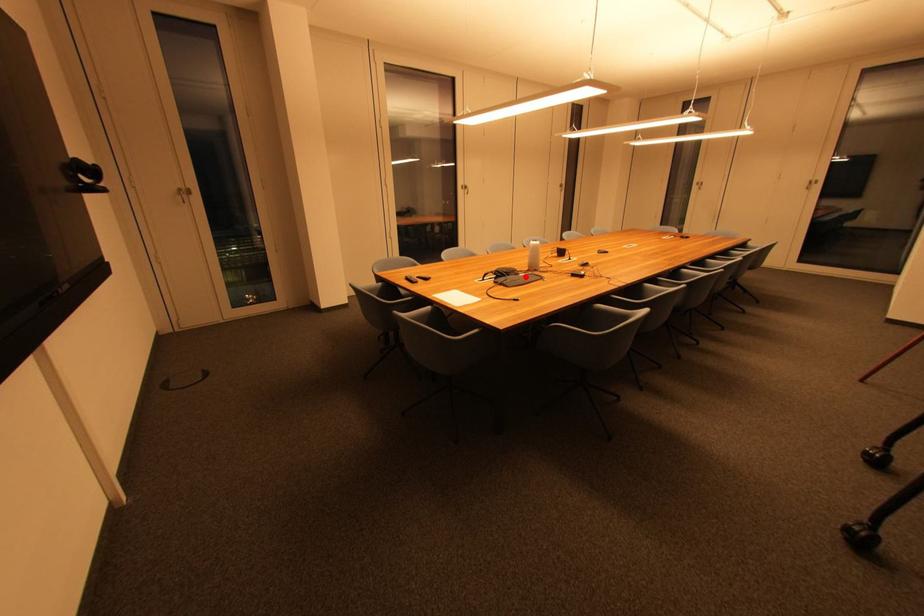
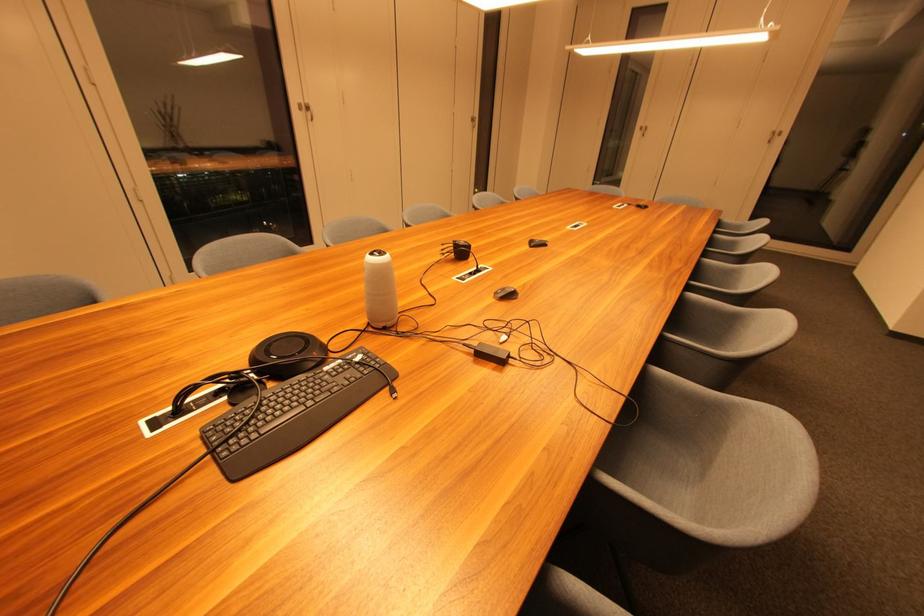
Where in the second image is the point corresponding to the highlighted location from the first image?

(332, 371)